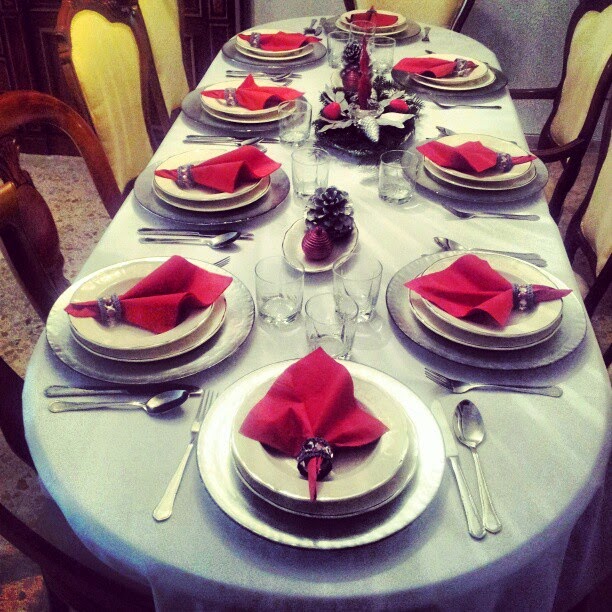
Where is `drinking glasses`? The height and width of the screenshot is (612, 612). drinking glasses is located at coordinates (336, 40), (385, 49), (289, 113), (401, 169), (308, 165), (371, 292), (271, 278), (319, 307), (362, 32).